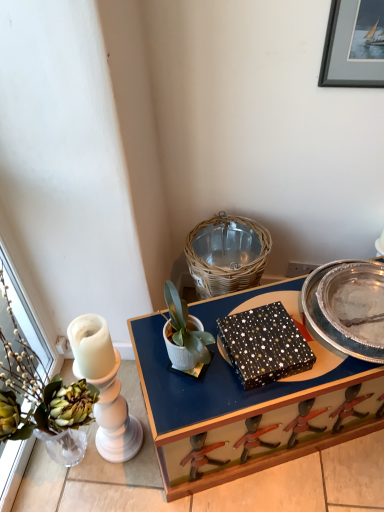
Identify the location of vacant space in front of white matte pot at center. Image resolution: width=384 pixels, height=512 pixels. (193, 400).